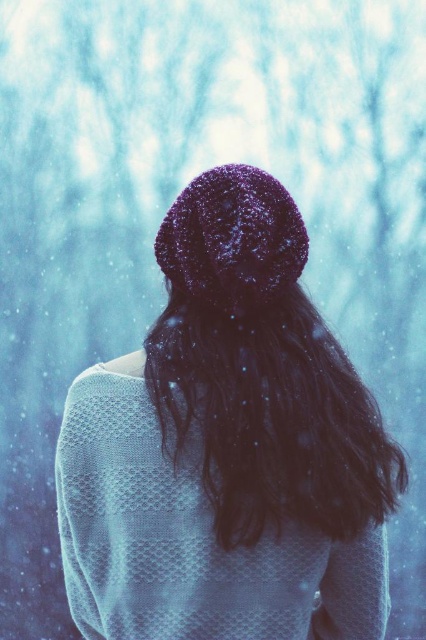
You are standing behind the person in the winter scene and want to place a small decoration on the point closer to you between point (201, 477) and point (279, 461). Which point should you choose?

You should choose point (201, 477) because it is closer to you than point (279, 461).

You are a fashion designer observing the winter scene. You notice the sparkly purple knit hat at center and the dark matte hair at center. Which object is positioned higher in the image?

The sparkly purple knit hat at center is taller than dark matte hair at center, so the sparkly purple knit hat at center is positioned higher in the image.

You are standing behind a person in a winter scene and see the point marked at coordinates (x=227, y=448). What object is located at that point?

The point at coordinates (x=227, y=448) marks the sparkly purple knit hat at center.